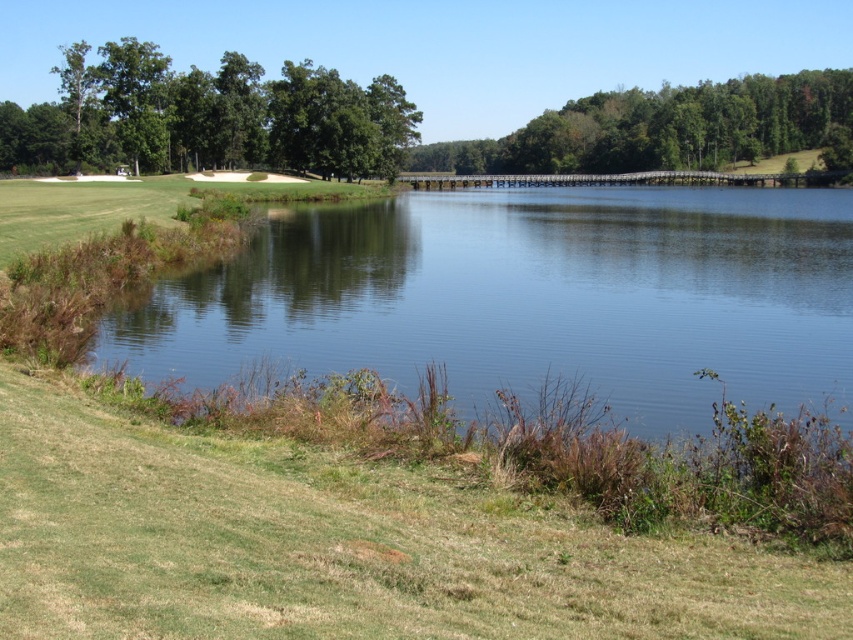
Question: Among these objects, which one is farthest from the camera?

Choices:
 (A) clear water at center
 (B) green grass at lower left

Answer: (A)

Question: Is green grass at lower left below green leafy tree at upper left?

Choices:
 (A) no
 (B) yes

Answer: (B)

Question: Among these points, which one is nearest to the camera?

Choices:
 (A) (251, 520)
 (B) (625, 305)
 (C) (653, 92)
 (D) (303, 170)

Answer: (A)

Question: Is clear water at center positioned in front of green leafy trees at upper right?

Choices:
 (A) yes
 (B) no

Answer: (A)

Question: Does green grass at lower left have a lesser width compared to clear water at center?

Choices:
 (A) yes
 (B) no

Answer: (A)

Question: Among these objects, which one is farthest from the camera?

Choices:
 (A) green leafy trees at upper right
 (B) green grass at lower left
 (C) clear water at center

Answer: (A)